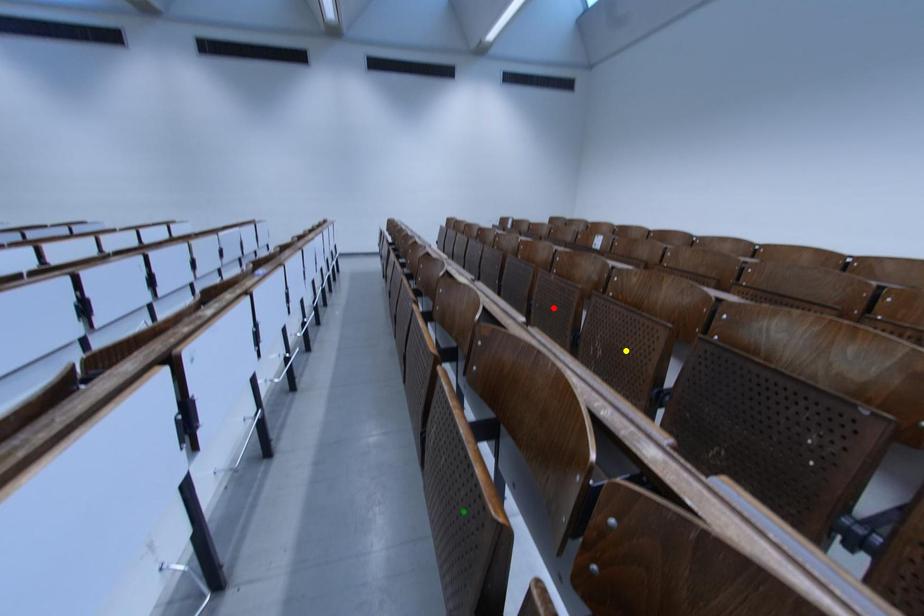
Order these from nearest to farthest:
yellow point, red point, green point

yellow point, red point, green point